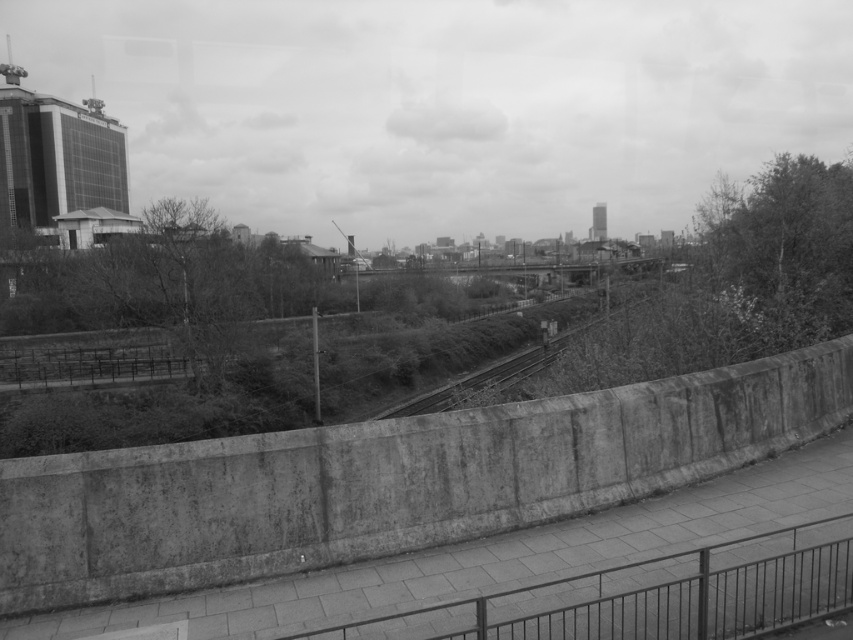
Question: Among these objects, which one is nearest to the camera?

Choices:
 (A) smooth concrete train track at center
 (B) metal/rusty rail at lower center

Answer: (B)

Question: Does metal/rusty rail at lower center have a lesser width compared to smooth concrete train track at center?

Choices:
 (A) no
 (B) yes

Answer: (B)

Question: Is metal/rusty rail at lower center thinner than smooth concrete train track at center?

Choices:
 (A) no
 (B) yes

Answer: (B)

Question: Is metal/rusty rail at lower center positioned before smooth concrete train track at center?

Choices:
 (A) no
 (B) yes

Answer: (B)